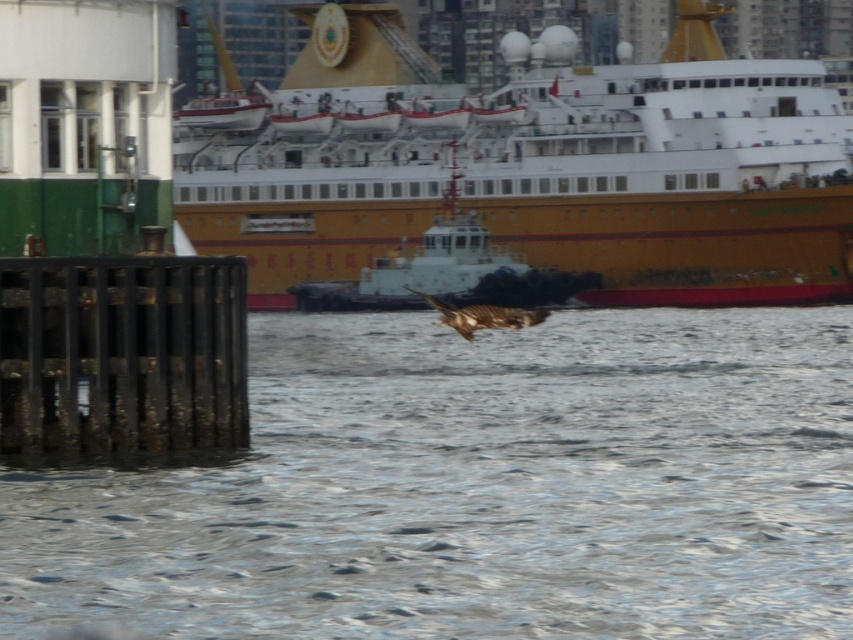
You are standing at the point marked as point (498, 504) and want to throw a stone to hit the cruise ship in the background. If the maximum distance you can throw is 20 meters, will you be able to reach it?

The distance between you and the cruise ship is 22.03 meters, which is beyond your throwing range of 20 meters. You won not be able to reach it.

You are a wildlife photographer aiming to capture the brown feathered bird at center without the translucent gray water at center obstructing the view. Can you position yourself in such a way that the bird is clearly visible while the water is out of frame?

The distance between the translucent gray water at center and the brown feathered bird at center is 12.12 meters. Since the bird is flying above the water, positioning yourself at an angle where the water is not in the same plane as the bird would allow you to capture the bird without the water obstructing the view.